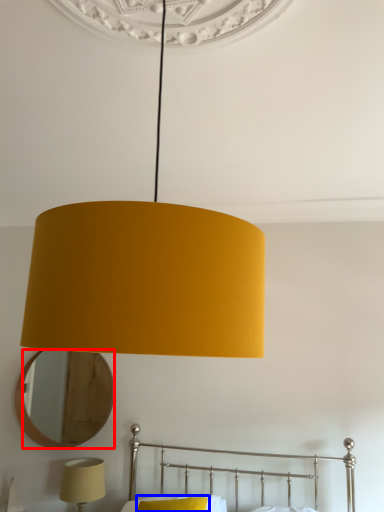
Question: Which object is closer to the camera taking this photo, mirror (highlighted by a red box) or pillow (highlighted by a blue box)?

Choices:
 (A) mirror
 (B) pillow

Answer: (B)